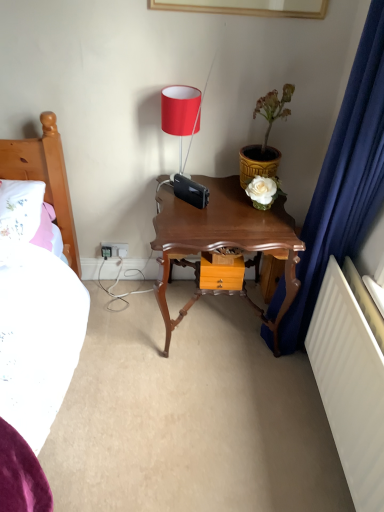
Question: Is yellow textured pot at upper right inside white plastic electrical outlet at lower left?

Choices:
 (A) yes
 (B) no

Answer: (B)

Question: Can you see white plastic electrical outlet at lower left touching yellow textured pot at upper right?

Choices:
 (A) yes
 (B) no

Answer: (B)

Question: From the image's perspective, is white plastic electrical outlet at lower left below yellow textured pot at upper right?

Choices:
 (A) yes
 (B) no

Answer: (A)

Question: Would you consider white plastic electrical outlet at lower left to be distant from yellow textured pot at upper right?

Choices:
 (A) yes
 (B) no

Answer: (B)

Question: From a real-world perspective, is white plastic electrical outlet at lower left physically below yellow textured pot at upper right?

Choices:
 (A) yes
 (B) no

Answer: (A)

Question: Is white plastic electrical outlet at lower left shorter than yellow textured pot at upper right?

Choices:
 (A) yes
 (B) no

Answer: (A)

Question: Is shiny brown wooden nightstand at center completely or partially inside white plastic electrical outlet at lower left?

Choices:
 (A) yes
 (B) no

Answer: (B)

Question: Is white plastic electrical outlet at lower left positioned behind shiny brown wooden nightstand at center?

Choices:
 (A) no
 (B) yes

Answer: (B)

Question: From a real-world perspective, is white plastic electrical outlet at lower left located beneath shiny brown wooden nightstand at center?

Choices:
 (A) yes
 (B) no

Answer: (A)

Question: Can you confirm if white plastic electrical outlet at lower left is bigger than shiny brown wooden nightstand at center?

Choices:
 (A) yes
 (B) no

Answer: (B)

Question: Is white plastic electrical outlet at lower left taller than shiny brown wooden nightstand at center?

Choices:
 (A) no
 (B) yes

Answer: (A)

Question: Can you confirm if white plastic electrical outlet at lower left is positioned to the left of shiny brown wooden nightstand at center?

Choices:
 (A) no
 (B) yes

Answer: (B)

Question: Does yellow textured pot at upper right appear on the right side of shiny brown wooden nightstand at center?

Choices:
 (A) no
 (B) yes

Answer: (B)